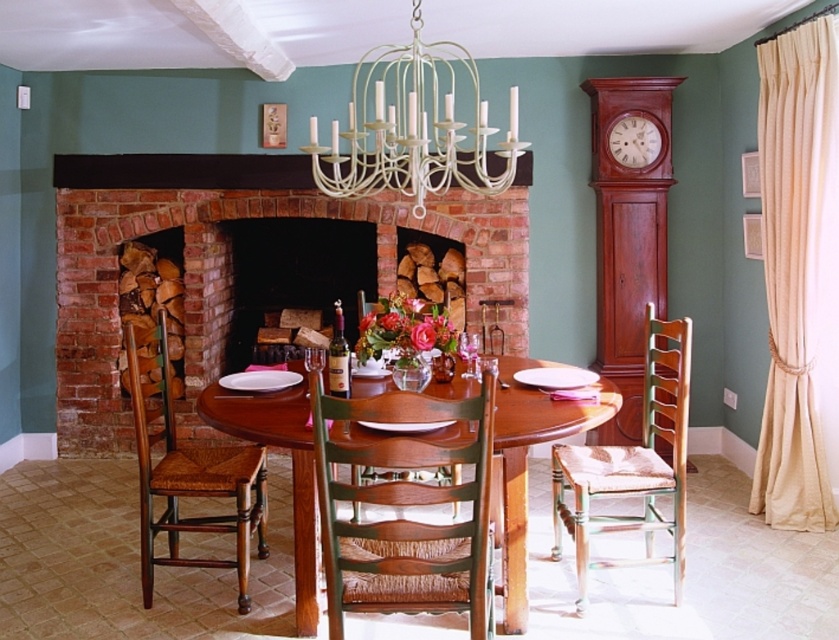
You are planning to install a new lighting fixture in the dining room. You have a choice between the white matte chandelier at upper center and the brown wooden clock at right. If you want the fixture that takes up more space, which one should you choose?

The white matte chandelier at upper center is larger in size than the brown wooden clock at right, so you should choose the white matte chandelier at upper center if you want the fixture that takes up more space.

You are planning to hang a new painting in the dining room. The painting is 1.5 meters wide. You want to place it above the brown wooden clock at right but ensure it doesn not block the white matte chandelier at upper center. Is this possible?

The white matte chandelier at upper center is positioned over the brown wooden clock at right. Since the chandelier is already above the clock, hanging a painting above the clock would place it below the chandelier, so it won not block the chandelier. Therefore, it is possible to hang the painting there without blocking the chandelier.

You are sitting at the dining table in the center of the room and want to light the firewood in the brick fireplace at center. To reach it, you need to move around the brown woven wood chair at center. Which direction should you move relative to the chair?

The brown woven wood chair at center is behind the brick fireplace at center, so you should move forward towards the fireplace away from the chair to reach the firewood.